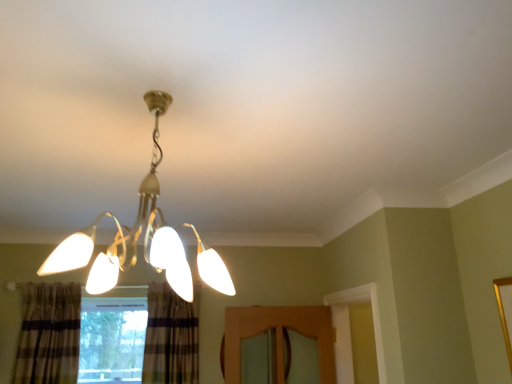
Question: In terms of size, does plaid fabric curtain at lower center, which is the first curtain from right to left, appear bigger or smaller than clear glass window at lower left?

Choices:
 (A) big
 (B) small

Answer: (B)

Question: Considering the positions of plaid fabric curtain at lower center, which is the first curtain from right to left, and clear glass window at lower left in the image, is plaid fabric curtain at lower center, which is the first curtain from right to left, wider or thinner than clear glass window at lower left?

Choices:
 (A) thin
 (B) wide

Answer: (B)

Question: Which is farther from the clear glass window at lower left?

Choices:
 (A) matte gold chandelier at center
 (B) plaid fabric curtain at lower left, which is counted as the 1th curtain, starting from the left
 (C) plaid fabric curtain at lower center, which is the first curtain from right to left

Answer: (A)

Question: Based on their relative distances, which object is farther from the clear glass window at lower left?

Choices:
 (A) plaid fabric curtain at lower left, which is counted as the 1th curtain, starting from the left
 (B) plaid fabric curtain at lower center, the 2th curtain positioned from the left
 (C) matte gold chandelier at center

Answer: (C)